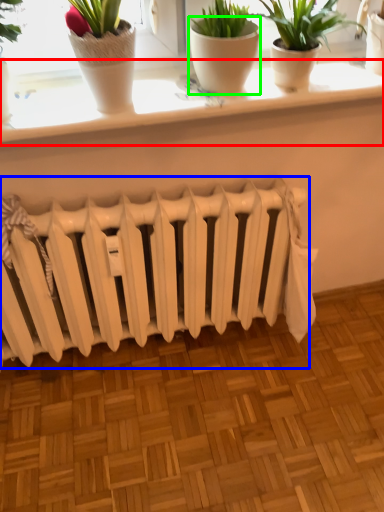
Question: Considering the real-world distances, which object is farthest from window sill (highlighted by a red box)? radiator (highlighted by a blue box) or flowerpot (highlighted by a green box)?

Choices:
 (A) radiator
 (B) flowerpot

Answer: (A)